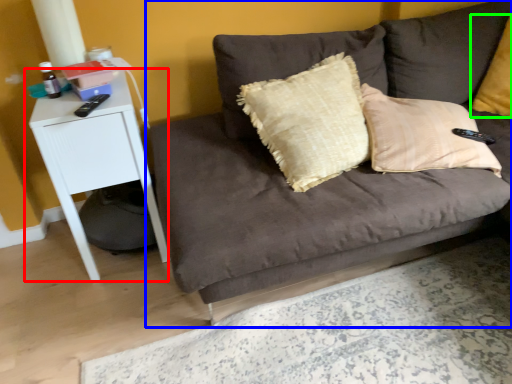
Question: Which is farther away from table (highlighted by a red box)? studio couch (highlighted by a blue box) or pillow (highlighted by a green box)?

Choices:
 (A) studio couch
 (B) pillow

Answer: (B)